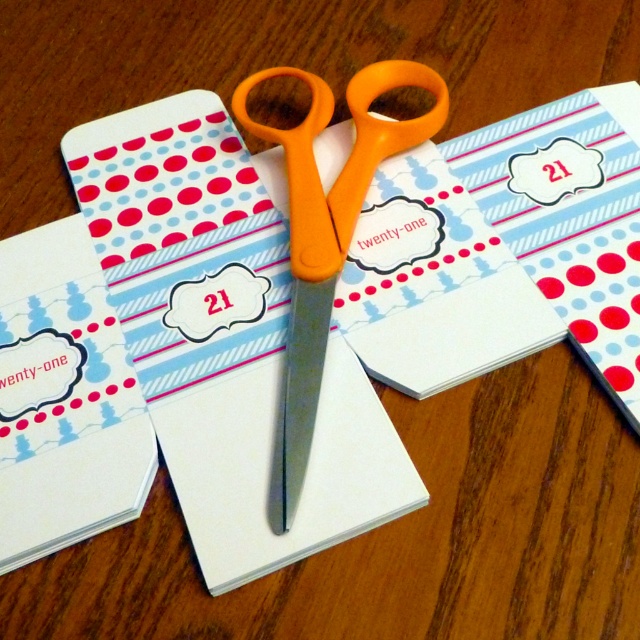
Question: Does matte paper envelope at center appear over matte white envelope at center?

Choices:
 (A) yes
 (B) no

Answer: (A)

Question: Is matte paper envelope at center positioned behind matte white envelope at center?

Choices:
 (A) no
 (B) yes

Answer: (A)

Question: Estimate the real-world distances between objects in this image. Which object is closer to the orange plastic scissors at center?

Choices:
 (A) matte paper envelope at center
 (B) matte white envelope at center

Answer: (A)

Question: Among these objects, which one is nearest to the camera?

Choices:
 (A) orange plastic scissors at center
 (B) matte white envelope at center
 (C) matte paper envelope at center

Answer: (C)

Question: Is matte white envelope at center to the left of orange plastic scissors at center from the viewer's perspective?

Choices:
 (A) no
 (B) yes

Answer: (B)

Question: Which point is farther from the camera taking this photo?

Choices:
 (A) (48, 369)
 (B) (296, 448)
 (C) (268, 484)

Answer: (A)